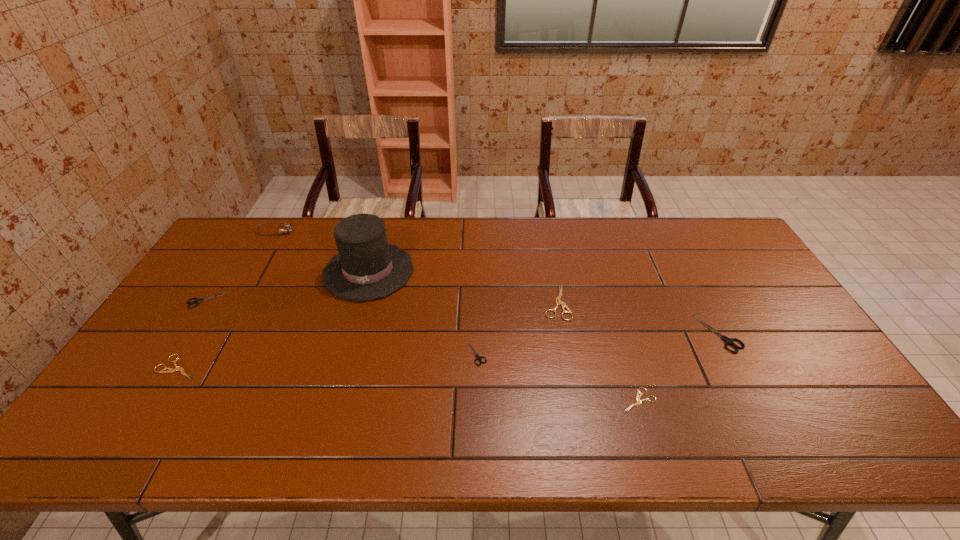
Locate an element on the screen. vacant area between the farthest object and the farthest beige shears is located at coordinates (416, 267).

Where is `free space between the sixth shortest object and the purple dress hat`? This screenshot has width=960, height=540. free space between the sixth shortest object and the purple dress hat is located at coordinates (544, 302).

I want to click on unoccupied area between the fourth shears from right to left and the rightmost object, so click(598, 343).

Find the location of a particular element. The image size is (960, 540). free space between the goggles and the leftmost beige shears is located at coordinates click(x=228, y=299).

Identify which object is the fifth nearest to the second biggest beige shears. Please provide its 2D coordinates. Your answer should be formatted as a tuple, i.e. [(x, y)], where the tuple contains the x and y coordinates of a point satisfying the conditions above.

[(558, 302)]

Locate an element on the screen. The image size is (960, 540). object that ranks as the seventh closest to the second beige shears from right to left is located at coordinates (197, 301).

Identify which shears is located as the third nearest to the leftmost black shears. Please provide its 2D coordinates. Your answer should be formatted as a tuple, i.e. [(x, y)], where the tuple contains the x and y coordinates of a point satisfying the conditions above.

[(558, 302)]

The width and height of the screenshot is (960, 540). Identify the location of shears that is the third closest to the farthest black shears. (558, 302).

Identify which black shears is the second closest to the fourth object from left to right. Please provide its 2D coordinates. Your answer should be formatted as a tuple, i.e. [(x, y)], where the tuple contains the x and y coordinates of a point satisfying the conditions above.

[(197, 301)]

Locate which black shears is the closest to the nearest shears. Please provide its 2D coordinates. Your answer should be formatted as a tuple, i.e. [(x, y)], where the tuple contains the x and y coordinates of a point satisfying the conditions above.

[(728, 341)]